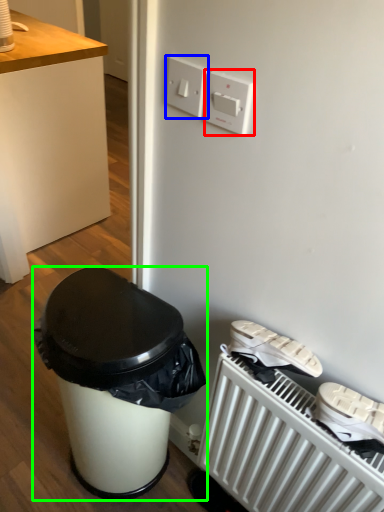
Question: Which object is positioned closest to light switch (highlighted by a red box)? Select from electric outlet (highlighted by a blue box) and waste container (highlighted by a green box).

Choices:
 (A) electric outlet
 (B) waste container

Answer: (A)